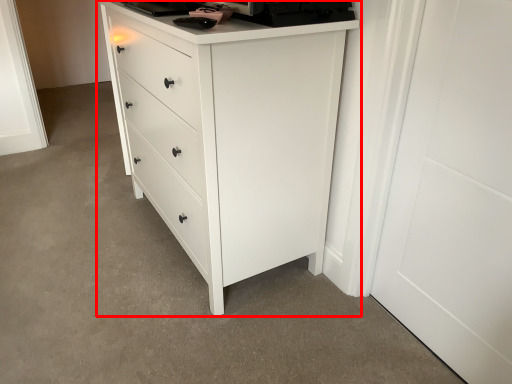
Question: From the image, what is the correct spatial relationship of chest of drawers (annotated by the red box) in relation to door?

Choices:
 (A) left
 (B) right

Answer: (A)